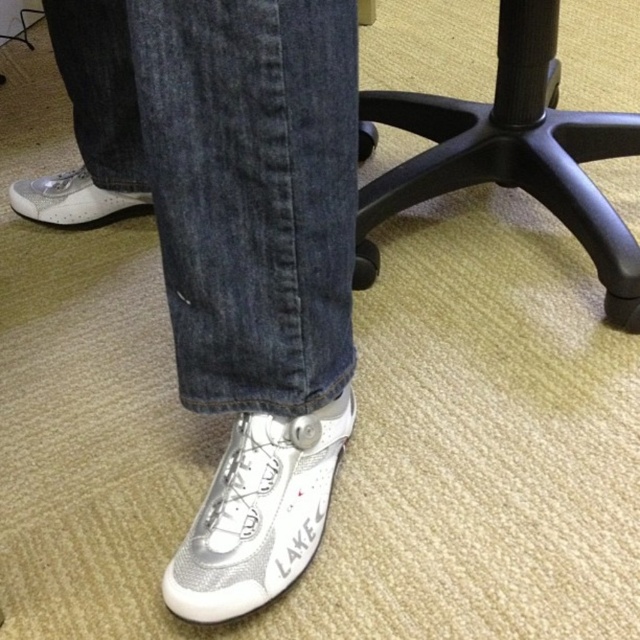
Question: Which object is the closest to the white mesh shoe at lower center?

Choices:
 (A) black plastic chair at center
 (B) white mesh shoe at lower left

Answer: (A)

Question: Which point appears closest to the camera in this image?

Choices:
 (A) (180, 568)
 (B) (448, 102)
 (C) (232, 529)

Answer: (A)

Question: Which of the following is the farthest from the observer?

Choices:
 (A) (64, 221)
 (B) (611, 221)
 (C) (161, 248)

Answer: (A)

Question: Can you confirm if black plastic chair at center is positioned below white mesh shoe at lower center?

Choices:
 (A) no
 (B) yes

Answer: (A)

Question: Can you confirm if black plastic chair at center is bigger than white mesh shoe at lower left?

Choices:
 (A) no
 (B) yes

Answer: (B)

Question: Does black plastic chair at center have a larger size compared to white mesh shoe at lower center?

Choices:
 (A) no
 (B) yes

Answer: (B)